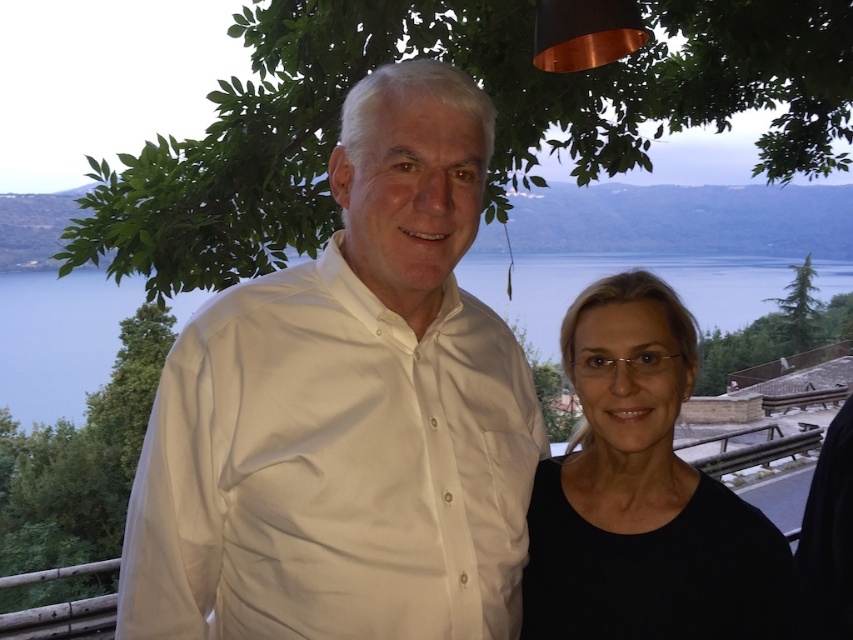
You are a photographer trying to capture the reflection of the white smooth shirt at center in the transparent water at center. Based on the scene, can you confirm if the shirt is positioned in a way that its reflection would be visible in the water?

The white smooth shirt at center is below transparent water at center, so its reflection would be visible in the water.

You are a photographer trying to capture a portrait of the person wearing the white smooth shirt at center. Based on the scene description, where should you position your camera to ensure the shirt is well lit by the available light?

The white smooth shirt at center is located at point (347,412), so positioning the camera to face the shirt directly would ensure it is well lit by the late afternoon or early evening light described in the scene.

You are a photographer who wants to place a focus point on the black matte shirt at right. The focus point is at coordinate point [643,493]. Is the focus point on the black matte shirt at right?

Yes, the focus point at point 0.755 is on the black matte shirt at right.